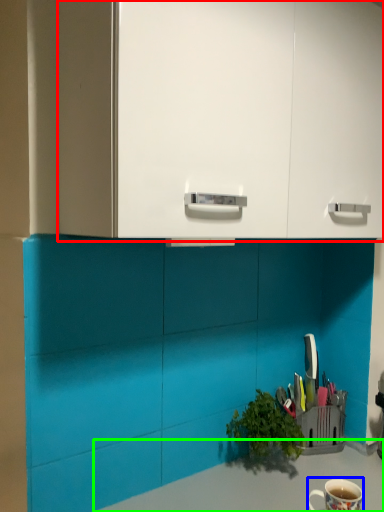
Question: Which object is positioned closest to dresser (highlighted by a red box)? Select from coffee cup (highlighted by a blue box) and counter top (highlighted by a green box).

Choices:
 (A) coffee cup
 (B) counter top

Answer: (B)